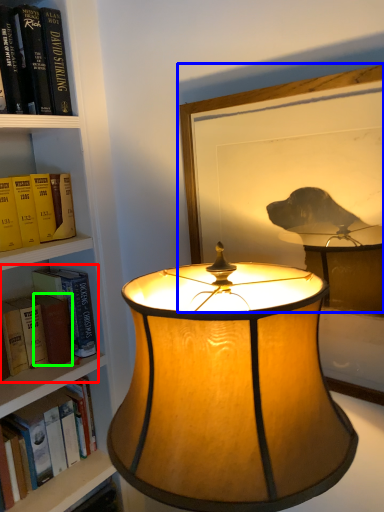
Question: Estimate the real-world distances between objects in this image. Which object is closer to book (highlighted by a red box), picture frame (highlighted by a blue box) or paperback book (highlighted by a green box)?

Choices:
 (A) picture frame
 (B) paperback book

Answer: (B)